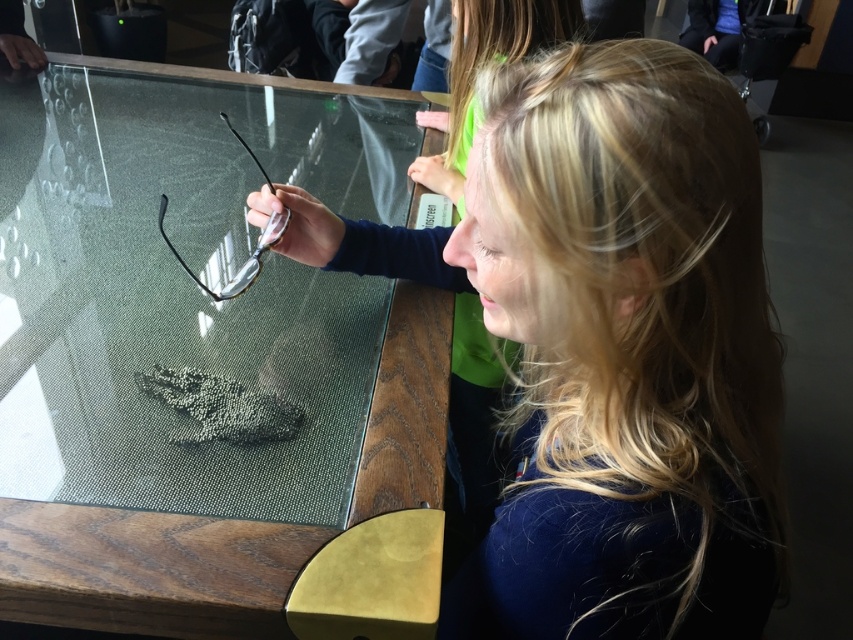
You are a visitor at an exhibition and you see the transparent textured glass at center and the black textured footprint at center on the display table. Which object is taller?

The transparent textured glass at center is taller than the black textured footprint at center.